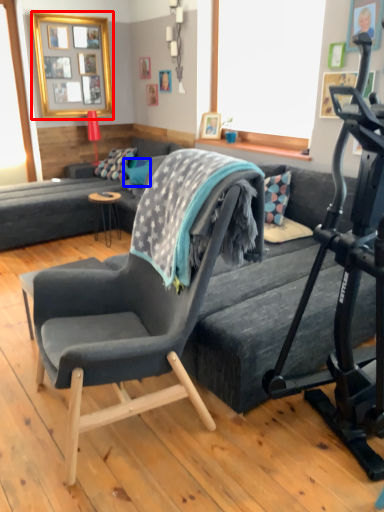
Question: Among these objects, which one is nearest to the camera, picture frame (highlighted by a red box) or pillow (highlighted by a blue box)?

Choices:
 (A) picture frame
 (B) pillow

Answer: (A)